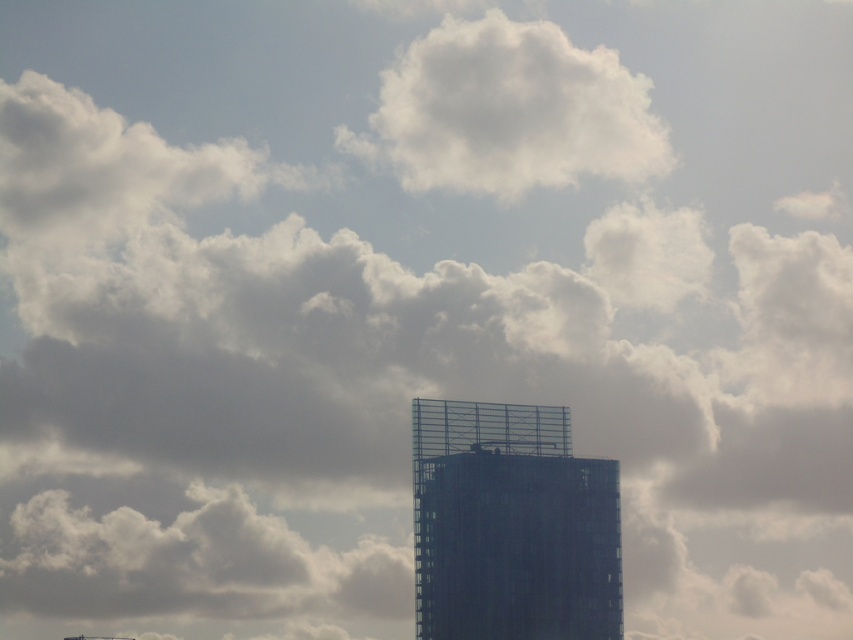
Which is in front, point (434, 582) or point (426, 38)?

Positioned in front is point (434, 582).

Is point (619, 600) farther from viewer compared to point (521, 156)?

That is True.

Locate an element on the screen. This screenshot has height=640, width=853. transparent glass tower at center is located at coordinates (511, 525).

Where is `transparent glass tower at center`? The image size is (853, 640). transparent glass tower at center is located at coordinates (511, 525).